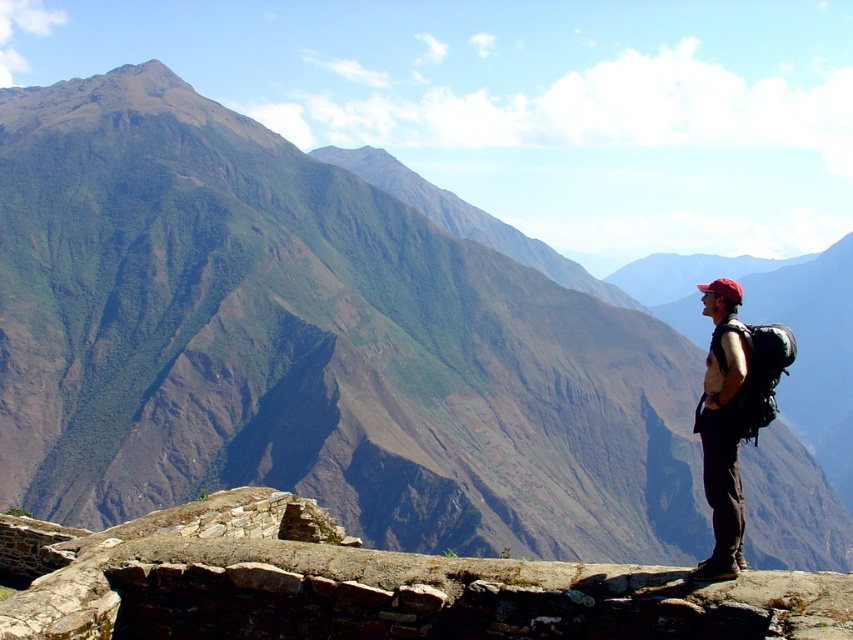
Question: Where is rustic stone wall at center located in relation to matte black backpack at right in the image?

Choices:
 (A) left
 (B) right

Answer: (A)

Question: Among these points, which one is farthest from the camera?

Choices:
 (A) (0, 625)
 (B) (718, 294)

Answer: (B)

Question: Observing the image, what is the correct spatial positioning of rustic stone wall at center in reference to matte black backpack at right?

Choices:
 (A) right
 (B) left

Answer: (B)

Question: Is rustic stone wall at center behind matte black backpack at right?

Choices:
 (A) yes
 (B) no

Answer: (B)